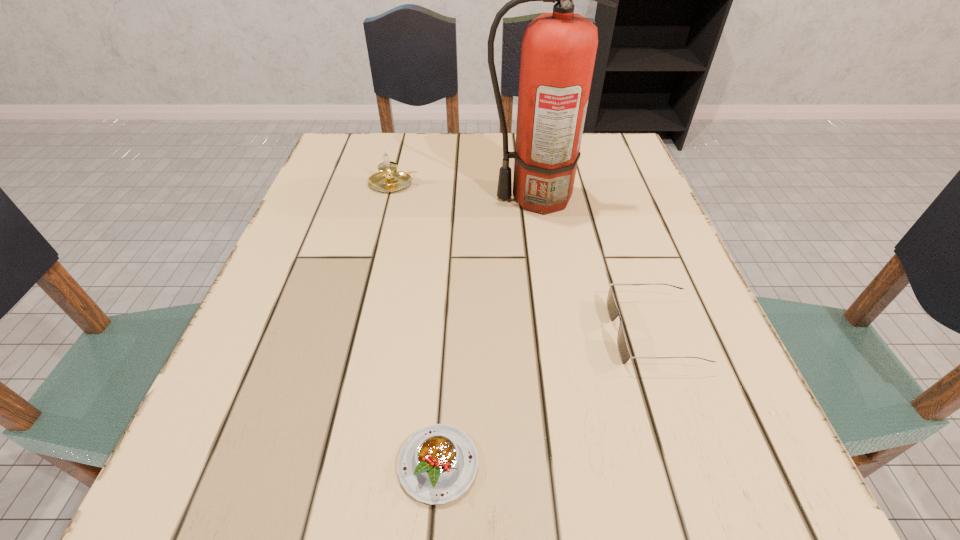
This screenshot has height=540, width=960. In order to click on vacant space that satisfies the following two spatial constraints: 1. on the handle side of the nearest object; 2. on the left side of the candle holder in this screenshot , I will do `click(324, 464)`.

Identify the location of vacant space that satisfies the following two spatial constraints: 1. on the back side of the pudding; 2. on the handle side of the third shortest object. The height and width of the screenshot is (540, 960). (457, 184).

This screenshot has height=540, width=960. I want to click on vacant space that satisfies the following two spatial constraints: 1. on the back side of the pudding; 2. on the handle side of the candle holder, so click(x=457, y=184).

Identify the location of free point that satisfies the following two spatial constraints: 1. on the handle side of the third object from right to left; 2. on the left side of the leftmost object. (324, 464).